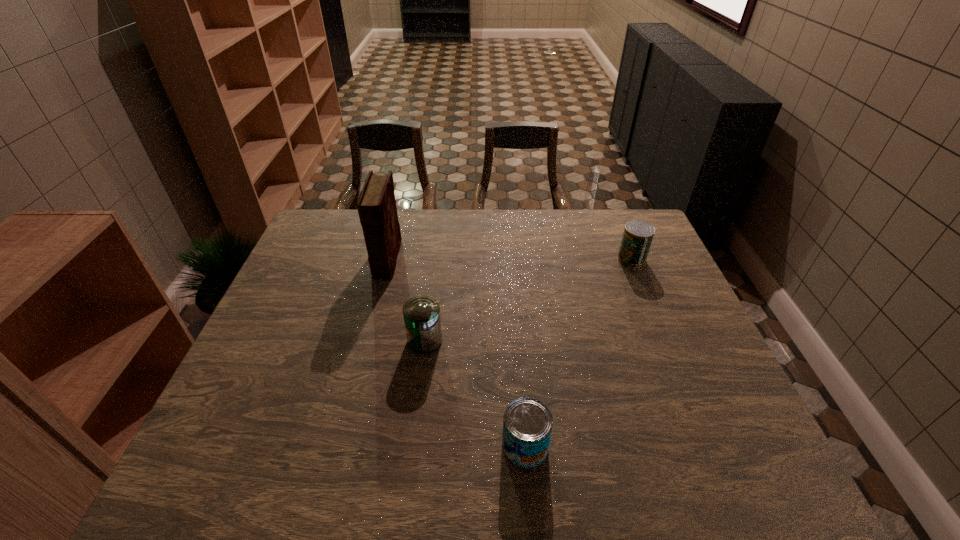
Find the location of a particular element. This screenshot has height=540, width=960. vacant position located 0.150m on the left of the rightmost can is located at coordinates (571, 259).

This screenshot has width=960, height=540. Find the location of `vacant space situated 0.300m on the right of the nearest object`. vacant space situated 0.300m on the right of the nearest object is located at coordinates (690, 446).

At what (x,y) coordinates should I click in order to perform the action: click on object that is positioned at the far edge. Please return your answer as a coordinate pair (x, y). This screenshot has height=540, width=960. Looking at the image, I should click on click(376, 205).

This screenshot has width=960, height=540. Find the location of `object located at the near edge`. object located at the near edge is located at coordinates (527, 423).

Locate an element on the screen. Image resolution: width=960 pixels, height=540 pixels. object that is at the right edge is located at coordinates (637, 237).

Identify the location of vacant region at the far edge of the desktop. This screenshot has width=960, height=540. (412, 228).

The height and width of the screenshot is (540, 960). What are the coordinates of `free space at the near edge of the desktop` in the screenshot? It's located at (573, 475).

Where is `vacant region at the left edge of the desktop`? The image size is (960, 540). vacant region at the left edge of the desktop is located at coordinates (322, 307).

In the image, there is a desktop. Where is `vacant space at the right edge`? The width and height of the screenshot is (960, 540). vacant space at the right edge is located at coordinates (679, 404).

Locate an element on the screen. Image resolution: width=960 pixels, height=540 pixels. vacant region at the far left corner is located at coordinates point(340,239).